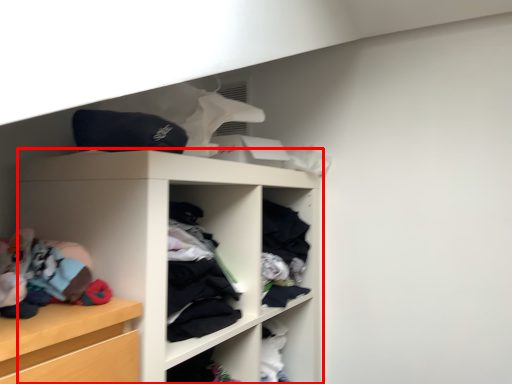
Question: Where is shelf (annotated by the red box) located in relation to clothing in the image?

Choices:
 (A) left
 (B) right

Answer: (B)